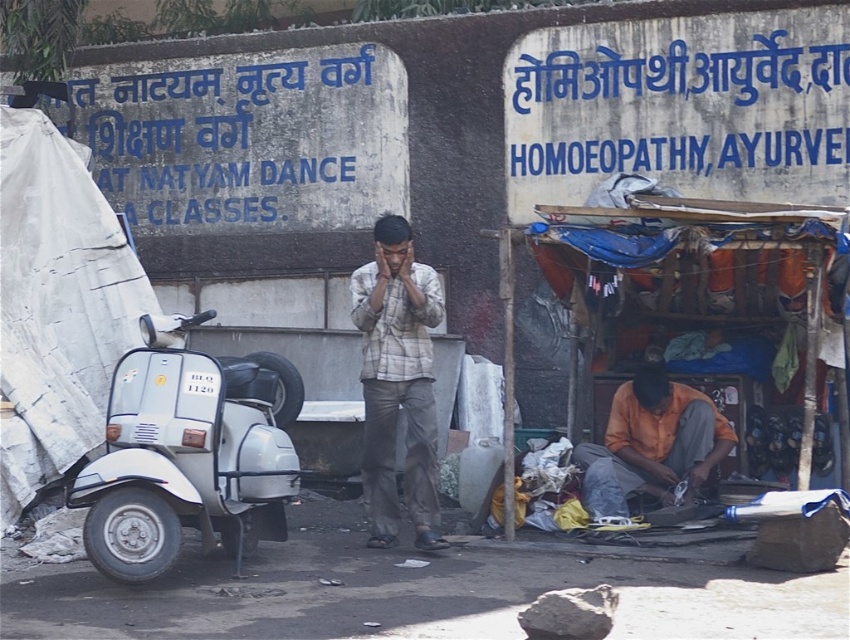
Can you confirm if white matte scooter at left is positioned below plaid fabric shirt at center?

Correct, white matte scooter at left is located below plaid fabric shirt at center.

Does point (140, 461) come closer to viewer compared to point (374, 428)?

That is True.

You are a GUI agent. You are given a task and a screenshot of the screen. Output one action in this format:
    pyautogui.click(x=<x>, y=<y>)
    Task: Click on the white matte scooter at left
    The height and width of the screenshot is (640, 850).
    Given the screenshot: What is the action you would take?
    pyautogui.click(x=184, y=460)

Can you confirm if plaid fabric shirt at center is shorter than orange fabric at lower center?

No, plaid fabric shirt at center is not shorter than orange fabric at lower center.

Which of these two, plaid fabric shirt at center or orange fabric at lower center, stands taller?

Standing taller between the two is plaid fabric shirt at center.

Find the location of `plaid fabric shirt at center`. plaid fabric shirt at center is located at coordinates (397, 381).

Between white matte scooter at left and orange fabric at lower center, which one appears on the left side from the viewer's perspective?

Positioned to the left is white matte scooter at left.

Does white matte scooter at left have a lesser height compared to orange fabric at lower center?

In fact, white matte scooter at left may be taller than orange fabric at lower center.

Is point (83, 493) positioned before point (581, 467)?

Yes, point (83, 493) is closer to viewer.

Where is `white matte scooter at left`? white matte scooter at left is located at coordinates (184, 460).